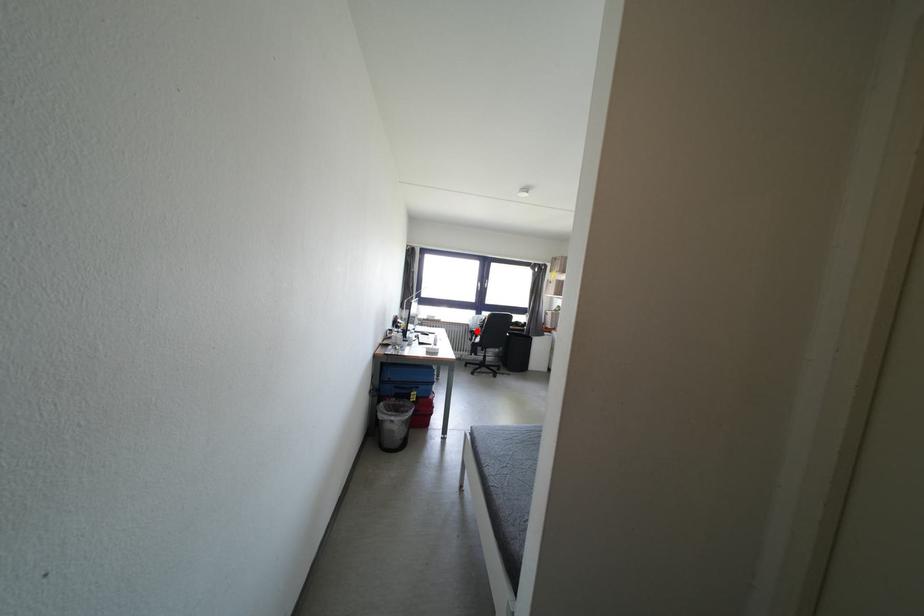
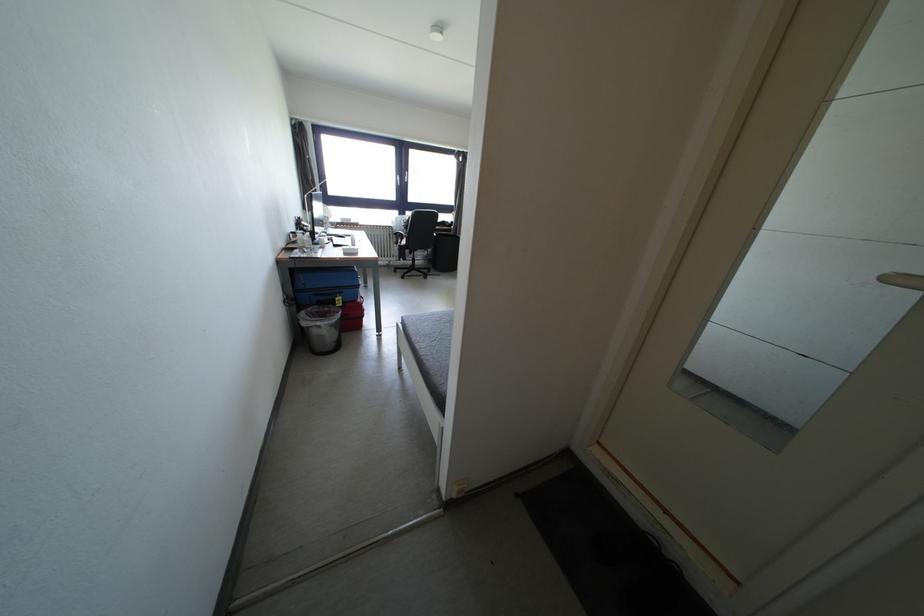
Where in the second image is the point corresponding to the highlighted location from the first image?

(400, 233)